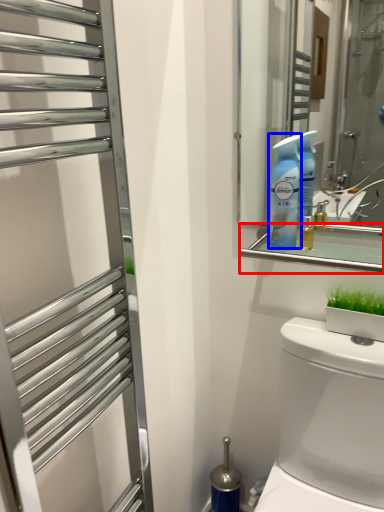
Question: Which of the following is the closest to the observer, balustrade (highlighted by a red box) or cleaning product (highlighted by a blue box)?

Choices:
 (A) balustrade
 (B) cleaning product

Answer: (A)